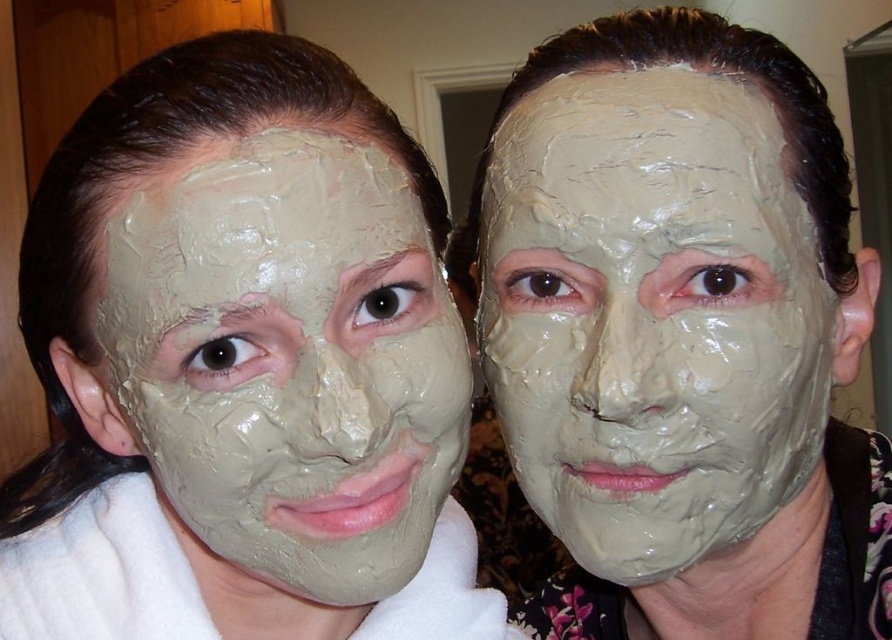
Is point (575, 80) positioned in front of point (211, 412)?

No, it is behind (211, 412).

Which is in front, point (522, 413) or point (348, 280)?

Point (348, 280)

Image resolution: width=892 pixels, height=640 pixels. I want to click on matte clay mask at center, so click(651, 316).